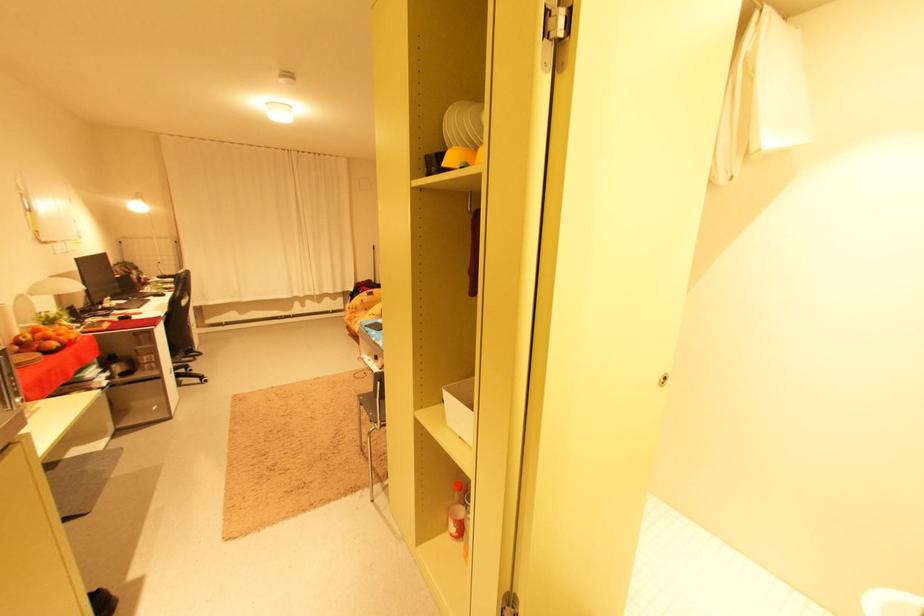
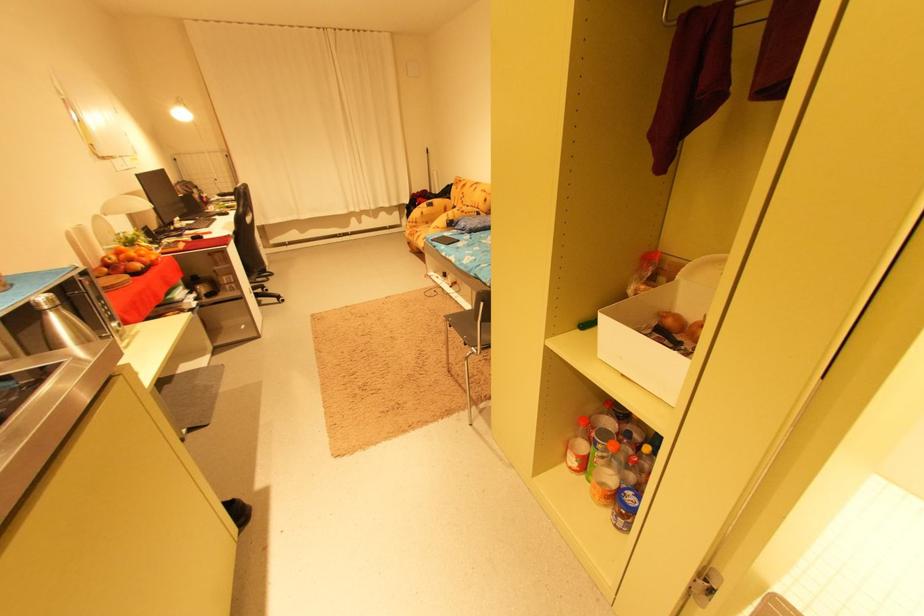
Where in the second image is the point corresponding to the highlighted location from the first image?

(151, 265)